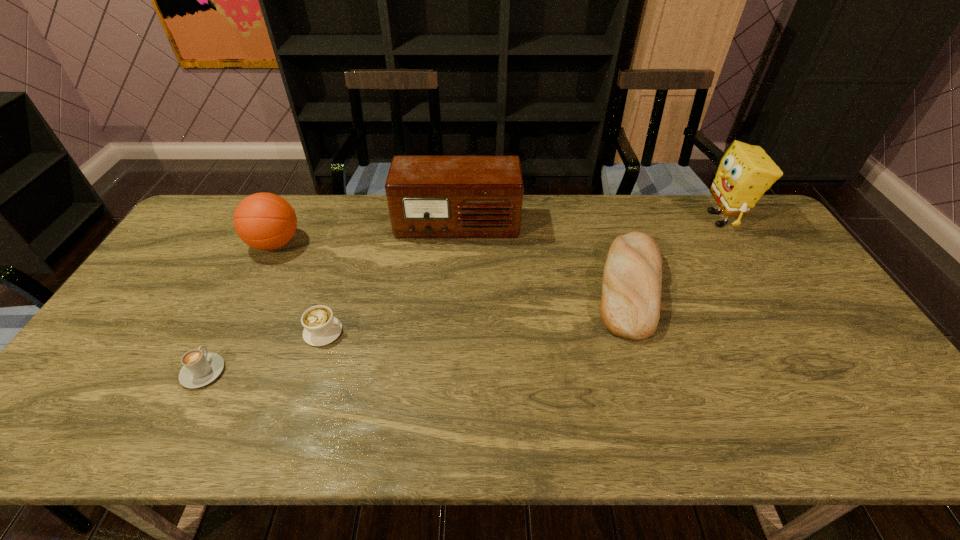
Locate an element on the screen. vacant space in between the sponge and the right cappuccino is located at coordinates (522, 275).

At what (x,y) coordinates should I click in order to perform the action: click on free space between the fourth shortest object and the second tallest object. Please return your answer as a coordinate pair (x, y). Looking at the image, I should click on (367, 234).

Locate an element on the screen. free spot between the fourth tallest object and the third object from left to right is located at coordinates pyautogui.click(x=476, y=309).

Identify the location of the fourth closest object to the basketball. (630, 304).

Identify the location of object that is the third closest one to the bread. (320, 327).

Where is `vacant space that satisfies the following two spatial constraints: 1. on the front side of the third shortest object; 2. to the right of the right cappuccino's handle`? vacant space that satisfies the following two spatial constraints: 1. on the front side of the third shortest object; 2. to the right of the right cappuccino's handle is located at coordinates (644, 332).

Image resolution: width=960 pixels, height=540 pixels. Identify the location of vacant space that satisfies the following two spatial constraints: 1. on the front-facing side of the radio receiver; 2. to the right of the fourth object from right to left's handle. (451, 332).

Identify the location of vacant space that satisfies the following two spatial constraints: 1. to the right of the fourth tallest object; 2. on the left side of the left cappuccino. (248, 286).

Identify the location of vacant area in the image that satisfies the following two spatial constraints: 1. on the front-facing side of the fourth object from left to right; 2. to the right of the fourth object from right to left's handle. (451, 332).